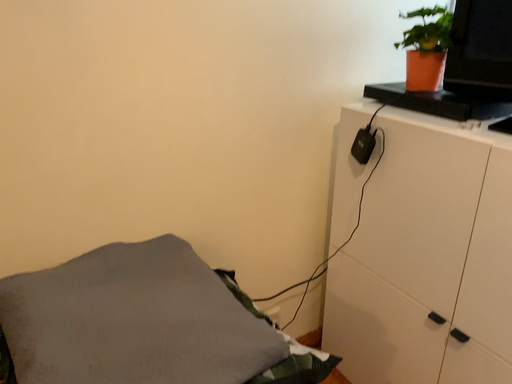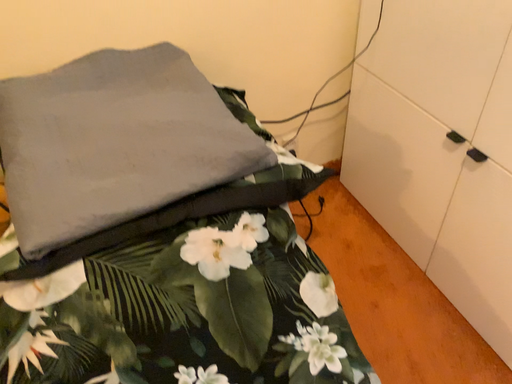
Question: How did the camera likely rotate when shooting the video?

Choices:
 (A) rotated left
 (B) rotated right

Answer: (A)